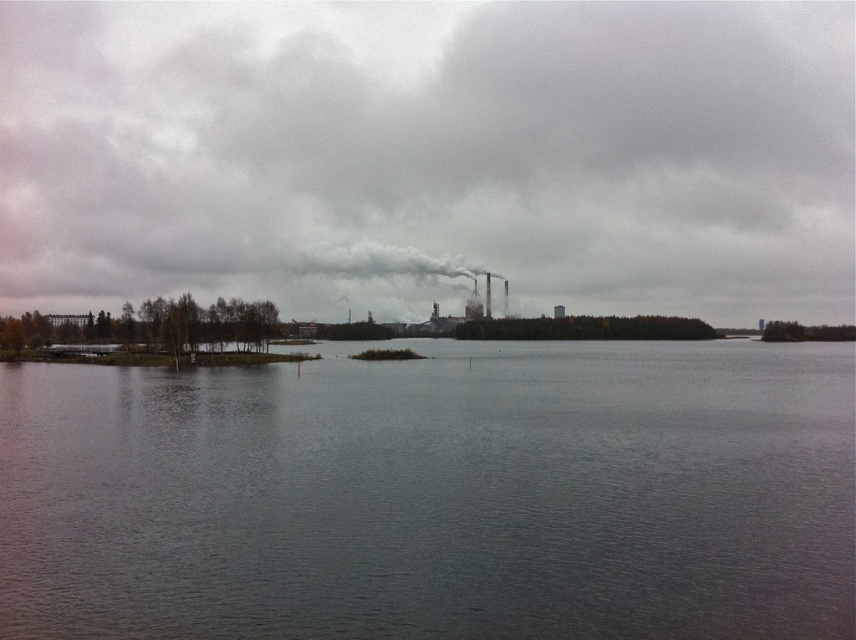
Who is taller, gray water at center or white smoke at center?

white smoke at center is taller.

Is gray water at center bigger than white smoke at center?

Actually, gray water at center might be smaller than white smoke at center.

I want to click on gray water at center, so click(x=435, y=497).